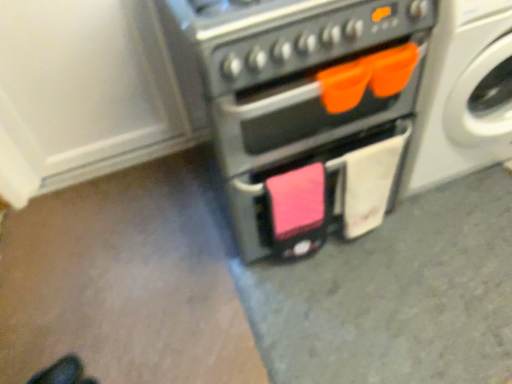
Question: Is point (226, 54) positioned closer to the camera than point (69, 354)?

Choices:
 (A) farther
 (B) closer

Answer: (B)

Question: In the image, is matte black oven at center positioned in front of or behind black leather shoes at lower left?

Choices:
 (A) front
 (B) behind

Answer: (A)

Question: Considering the real-world distances, which object is farthest from the matte black oven at center?

Choices:
 (A) white glossy washing machine at upper right
 (B) black leather shoes at lower left

Answer: (B)

Question: Which object is positioned farthest from the black leather shoes at lower left?

Choices:
 (A) matte black oven at center
 (B) white glossy washing machine at upper right

Answer: (B)